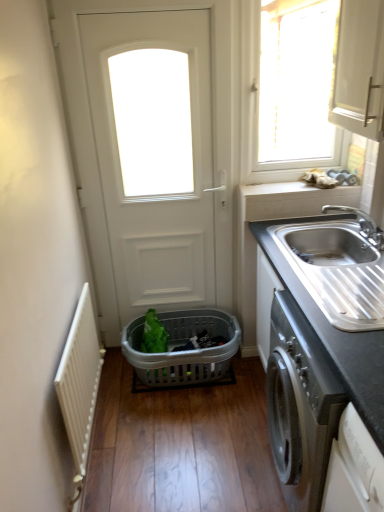
Question: Is white matte door at center turned away from white painted metal radiator at left?

Choices:
 (A) no
 (B) yes

Answer: (A)

Question: Is white matte door at center closer to the viewer compared to white painted metal radiator at left?

Choices:
 (A) no
 (B) yes

Answer: (A)

Question: From the image's perspective, does white matte door at center appear higher than white painted metal radiator at left?

Choices:
 (A) yes
 (B) no

Answer: (A)

Question: Is white matte door at center to the right of white painted metal radiator at left from the viewer's perspective?

Choices:
 (A) yes
 (B) no

Answer: (A)

Question: Considering the relative sizes of white matte door at center and white painted metal radiator at left in the image provided, is white matte door at center bigger than white painted metal radiator at left?

Choices:
 (A) yes
 (B) no

Answer: (A)

Question: Can you confirm if white matte door at center is taller than white painted metal radiator at left?

Choices:
 (A) no
 (B) yes

Answer: (B)

Question: Could you tell me if stainless steel sink at right is turned towards silver metallic faucet at sink right?

Choices:
 (A) no
 (B) yes

Answer: (A)

Question: From the image's perspective, is stainless steel sink at right above silver metallic faucet at sink right?

Choices:
 (A) yes
 (B) no

Answer: (B)

Question: From the image's perspective, does stainless steel sink at right appear lower than silver metallic faucet at sink right?

Choices:
 (A) yes
 (B) no

Answer: (A)

Question: Can you confirm if stainless steel sink at right is shorter than silver metallic faucet at sink right?

Choices:
 (A) yes
 (B) no

Answer: (B)

Question: From a real-world perspective, is stainless steel sink at right over silver metallic faucet at sink right?

Choices:
 (A) no
 (B) yes

Answer: (A)

Question: Would you say stainless steel sink at right contains silver metallic faucet at sink right?

Choices:
 (A) no
 (B) yes

Answer: (A)

Question: Considering the relative sizes of silver metallic faucet at sink right and black granite countertop at right in the image provided, is silver metallic faucet at sink right shorter than black granite countertop at right?

Choices:
 (A) no
 (B) yes

Answer: (B)